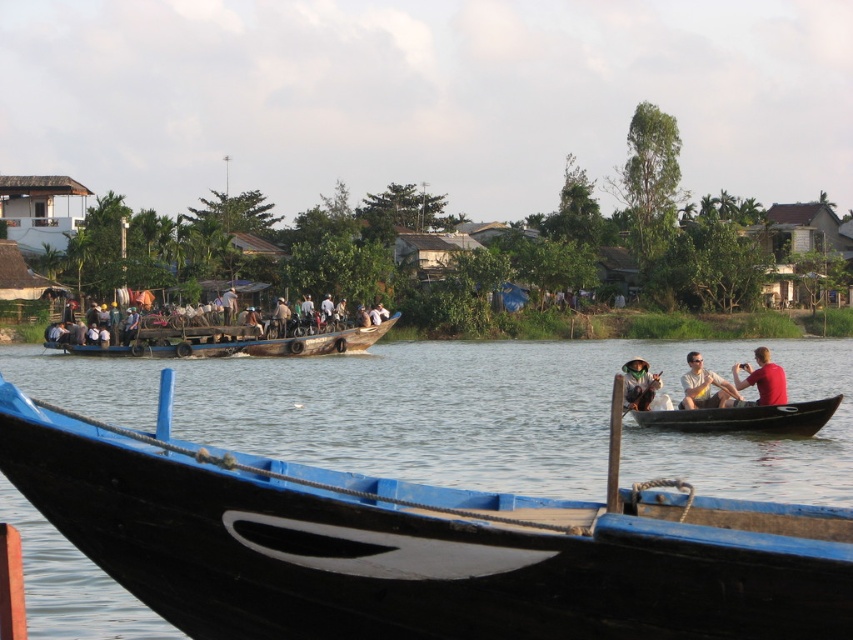
The image size is (853, 640). Identify the location of black wood canoe at right. (744, 417).

Is black wood canoe at right further to the viewer compared to matte green hat at lower right?

That is False.

Where is `black wood canoe at right`? This screenshot has width=853, height=640. black wood canoe at right is located at coordinates (744, 417).

Is black wood canoe at right to the left of red matte shirt at right from the viewer's perspective?

Correct, you'll find black wood canoe at right to the left of red matte shirt at right.

The height and width of the screenshot is (640, 853). Identify the location of black wood canoe at right. (744, 417).

Who is positioned more to the left, black wood boat at center or red matte shirt at right?

black wood boat at center is more to the left.

Is black wood boat at center taller than red matte shirt at right?

Yes.

Where is `black wood boat at center`? This screenshot has height=640, width=853. black wood boat at center is located at coordinates (379, 410).